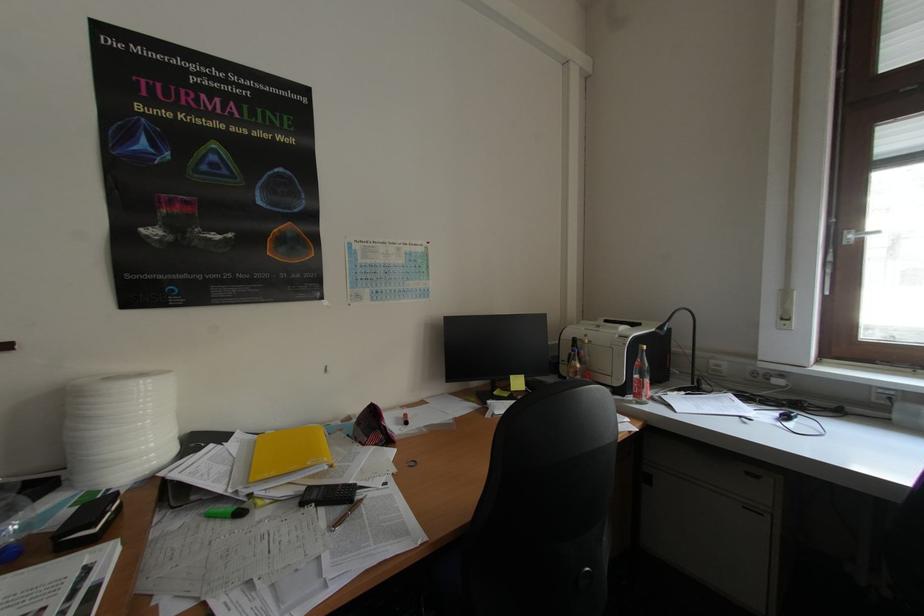
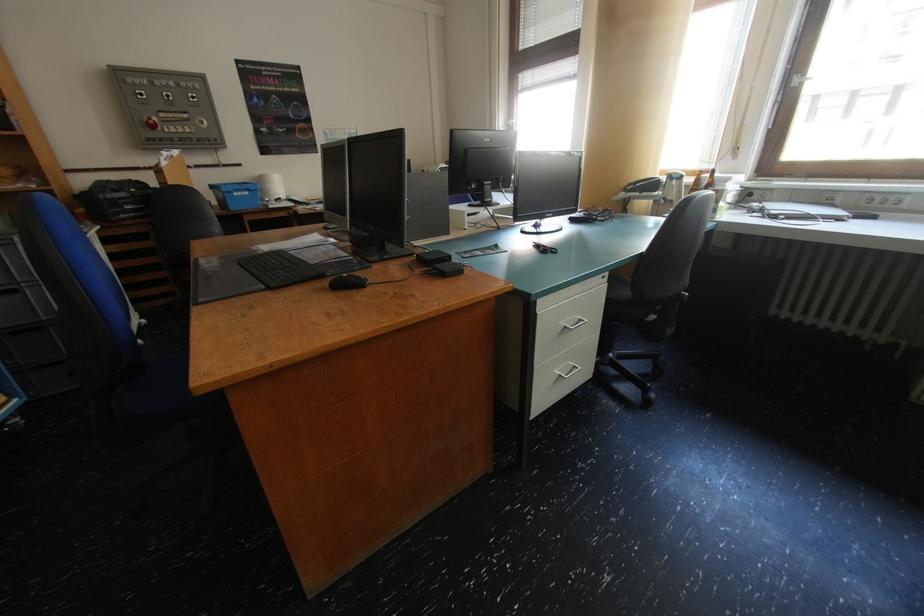
Looking at this image, what movement of the cameraman would produce the second image?

The movement direction of the cameraman is right, backward.